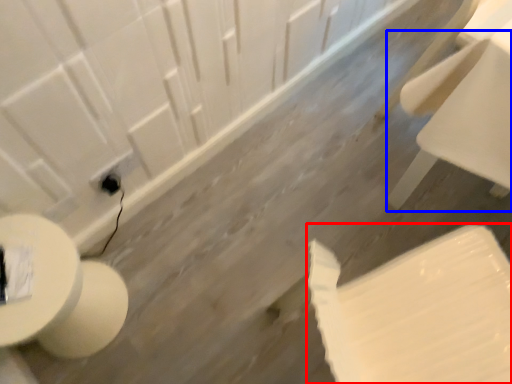
Question: Which object is further to the camera taking this photo, toilet paper (highlighted by a red box) or chair (highlighted by a blue box)?

Choices:
 (A) toilet paper
 (B) chair

Answer: (B)